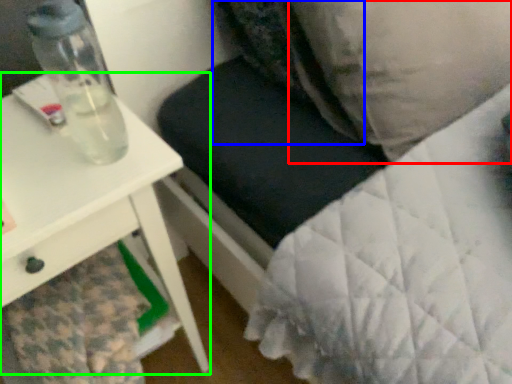
Question: Based on their relative distances, which object is nearer to pillow (highlighted by a red box)? Choose from pillow (highlighted by a blue box) and table (highlighted by a green box).

Choices:
 (A) pillow
 (B) table

Answer: (A)